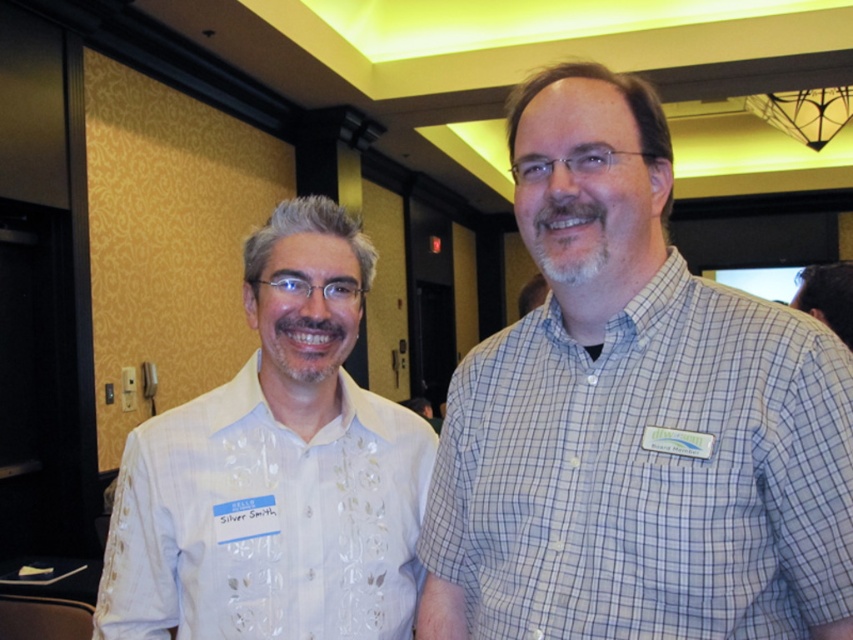
Is blue checkered shirt at right to the right of white embroidered shirt at left from the viewer's perspective?

Indeed, blue checkered shirt at right is positioned on the right side of white embroidered shirt at left.

Locate an element on the screen. The height and width of the screenshot is (640, 853). blue checkered shirt at right is located at coordinates (648, 472).